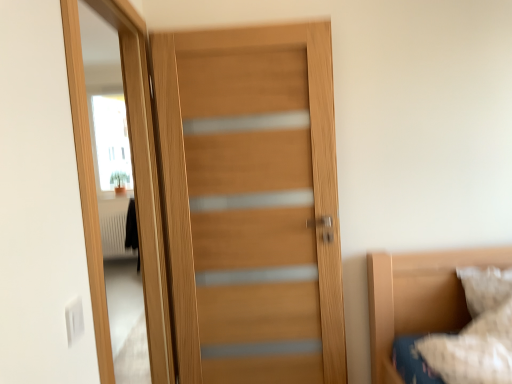
Question: Is white textured pillow at lower right behind wooden door at left?

Choices:
 (A) no
 (B) yes

Answer: (B)

Question: Is white textured pillow at lower right in front of wooden door at left?

Choices:
 (A) yes
 (B) no

Answer: (B)

Question: Does white textured pillow at lower right have a smaller size compared to wooden door at left?

Choices:
 (A) yes
 (B) no

Answer: (A)

Question: Is wooden door at left at the back of white textured pillow at lower right?

Choices:
 (A) yes
 (B) no

Answer: (B)

Question: Can you confirm if white textured pillow at lower right is positioned to the left of wooden door at left?

Choices:
 (A) no
 (B) yes

Answer: (A)

Question: Considering the relative sizes of white textured pillow at lower right and wooden door at left in the image provided, is white textured pillow at lower right taller than wooden door at left?

Choices:
 (A) no
 (B) yes

Answer: (A)

Question: From the image's perspective, is wooden door at center beneath white textured pillow at lower right?

Choices:
 (A) yes
 (B) no

Answer: (B)

Question: Can you confirm if wooden door at center is bigger than white textured pillow at lower right?

Choices:
 (A) yes
 (B) no

Answer: (A)

Question: From the image's perspective, does wooden door at center appear higher than white textured pillow at lower right?

Choices:
 (A) no
 (B) yes

Answer: (B)

Question: Does wooden door at center have a lesser height compared to white textured pillow at lower right?

Choices:
 (A) no
 (B) yes

Answer: (A)

Question: Are wooden door at center and white textured pillow at lower right beside each other?

Choices:
 (A) no
 (B) yes

Answer: (A)

Question: From a real-world perspective, is wooden door at center physically above white textured pillow at lower right?

Choices:
 (A) yes
 (B) no

Answer: (A)

Question: From a real-world perspective, is wooden door at left over white textured pillow at lower right?

Choices:
 (A) yes
 (B) no

Answer: (A)